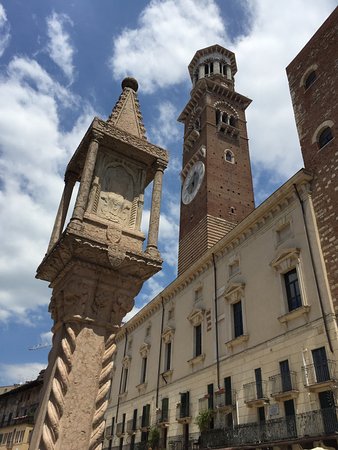
Identify the location of window. (197, 342).